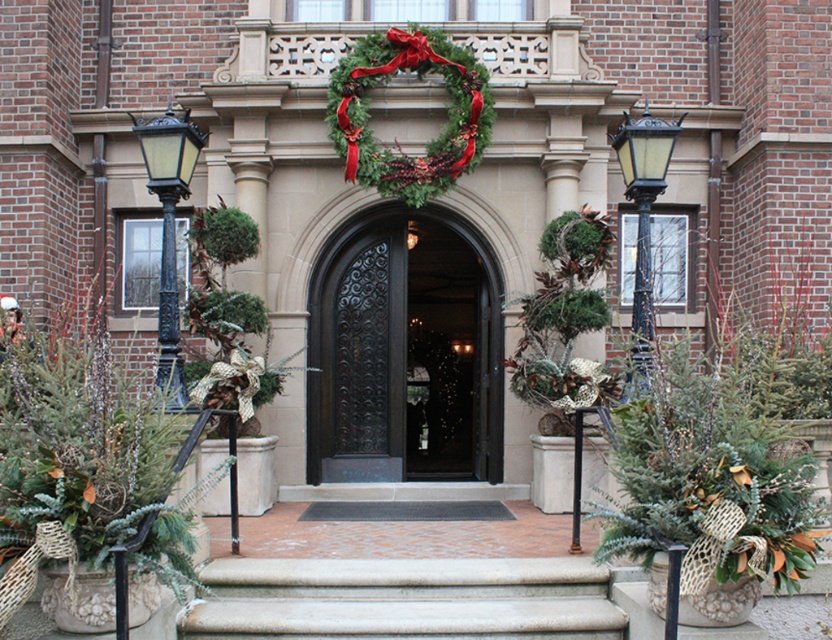
Does point (322, 604) come farther from viewer compared to point (382, 160)?

No, (322, 604) is closer to viewer.

Is point (213, 568) positioned in front of point (433, 36)?

Yes.

Where is `concrete steps at center`? The width and height of the screenshot is (832, 640). concrete steps at center is located at coordinates (404, 598).

Measure the distance between dark polished wood door at center and camera.

11.64 meters

Is dark polished wood door at center taller than black wrought iron door at center?

Yes.

This screenshot has height=640, width=832. What do you see at coordinates (404, 353) in the screenshot?
I see `dark polished wood door at center` at bounding box center [404, 353].

Where is `dark polished wood door at center`? This screenshot has height=640, width=832. dark polished wood door at center is located at coordinates (404, 353).

Is concrete steps at center below black wrought iron door at center?

Correct, concrete steps at center is located below black wrought iron door at center.

Who is more distant from viewer, (245,605) or (444,436)?

The point (444,436) is more distant.

Where is `concrete steps at center`? concrete steps at center is located at coordinates (404, 598).

Where is `concrete steps at center`? concrete steps at center is located at coordinates (404, 598).